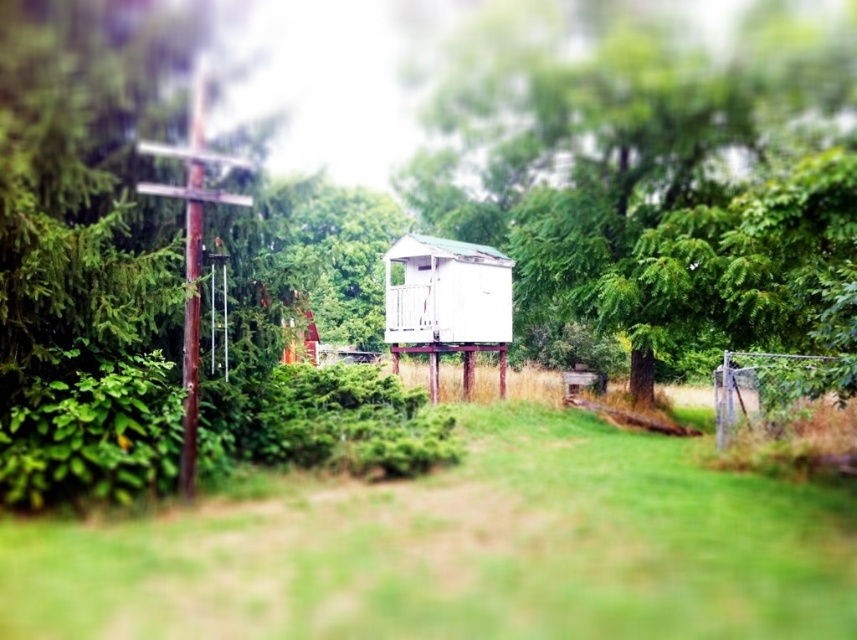
You are a GUI agent. You are given a task and a screenshot of the screen. Output one action in this format:
    pyautogui.click(x=<x>, y=<y>)
    Task: Click on the green leafy tree at center
    
    Given the screenshot: What is the action you would take?
    pyautogui.click(x=651, y=177)

Which is more to the left, green leafy tree at center or smooth brown wooden pole at left?

smooth brown wooden pole at left

Who is more distant from viewer, (699, 161) or (189, 227)?

Positioned behind is point (699, 161).

Locate an element on the screen. green leafy tree at center is located at coordinates (651, 177).

Who is more distant from viewer, (1,566) or (196,340)?

The point (196,340) is more distant.

In the scene shown: Which is more to the right, green grass at center or brown wooden pole at left?

green grass at center

This screenshot has width=857, height=640. Identify the location of green grass at center. (460, 550).

Consider the image. Does green grass at center appear on the left side of green leafy tree at center?

Correct, you'll find green grass at center to the left of green leafy tree at center.

Is point (460, 614) positioned before point (649, 288)?

Yes, it is.

The image size is (857, 640). I want to click on green grass at center, so click(x=460, y=550).